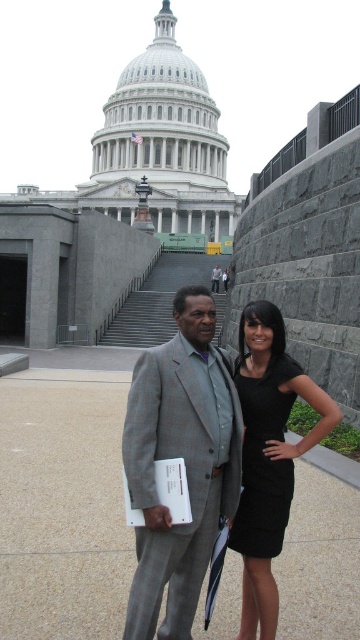
Question: Is black textured dress at center further to camera compared to gray suit at center?

Choices:
 (A) no
 (B) yes

Answer: (A)

Question: Which point appears closest to the camera in this image?

Choices:
 (A) (218, 291)
 (B) (191, 390)
 (C) (286, 452)
 (D) (262, 438)

Answer: (B)

Question: Which of the following is the farthest from the observer?

Choices:
 (A) black satin dress at center
 (B) gray suit at center
 (C) black textured dress at center
 (D) gray textured suit at center

Answer: (B)

Question: Is gray textured suit at center thinner than gray suit at center?

Choices:
 (A) no
 (B) yes

Answer: (A)

Question: Observing the image, what is the correct spatial positioning of black satin dress at center in reference to black textured dress at center?

Choices:
 (A) above
 (B) below

Answer: (B)

Question: Which of the following is the closest to the observer?

Choices:
 (A) black textured dress at center
 (B) black satin dress at center
 (C) gray textured suit at center
 (D) gray suit at center

Answer: (C)